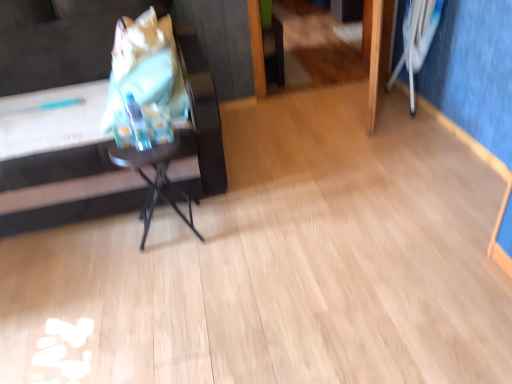
Question: Is white fabric swivel chair at upper right facing away from matte black side table at left?

Choices:
 (A) yes
 (B) no

Answer: (B)

Question: Does white fabric swivel chair at upper right have a greater height compared to matte black side table at left?

Choices:
 (A) no
 (B) yes

Answer: (A)

Question: Is white fabric swivel chair at upper right far away from matte black side table at left?

Choices:
 (A) yes
 (B) no

Answer: (A)

Question: From a real-world perspective, does white fabric swivel chair at upper right sit lower than matte black side table at left?

Choices:
 (A) no
 (B) yes

Answer: (B)

Question: From the image's perspective, is white fabric swivel chair at upper right on top of matte black side table at left?

Choices:
 (A) yes
 (B) no

Answer: (A)

Question: Considering the relative sizes of white fabric swivel chair at upper right and matte black side table at left in the image provided, is white fabric swivel chair at upper right bigger than matte black side table at left?

Choices:
 (A) yes
 (B) no

Answer: (B)

Question: Is white fabric swivel chair at upper right positioned far away from metallic black table at center?

Choices:
 (A) no
 (B) yes

Answer: (B)

Question: Considering the relative positions of white fabric swivel chair at upper right and metallic black table at center in the image provided, is white fabric swivel chair at upper right to the right of metallic black table at center from the viewer's perspective?

Choices:
 (A) no
 (B) yes

Answer: (B)

Question: Is white fabric swivel chair at upper right thinner than metallic black table at center?

Choices:
 (A) yes
 (B) no

Answer: (A)

Question: Considering the relative sizes of white fabric swivel chair at upper right and metallic black table at center in the image provided, is white fabric swivel chair at upper right shorter than metallic black table at center?

Choices:
 (A) no
 (B) yes

Answer: (A)

Question: Is white fabric swivel chair at upper right with metallic black table at center?

Choices:
 (A) yes
 (B) no

Answer: (B)

Question: Can you confirm if white fabric swivel chair at upper right is wider than metallic black table at center?

Choices:
 (A) no
 (B) yes

Answer: (A)

Question: Is matte black side table at left turned away from metallic black table at center?

Choices:
 (A) yes
 (B) no

Answer: (B)